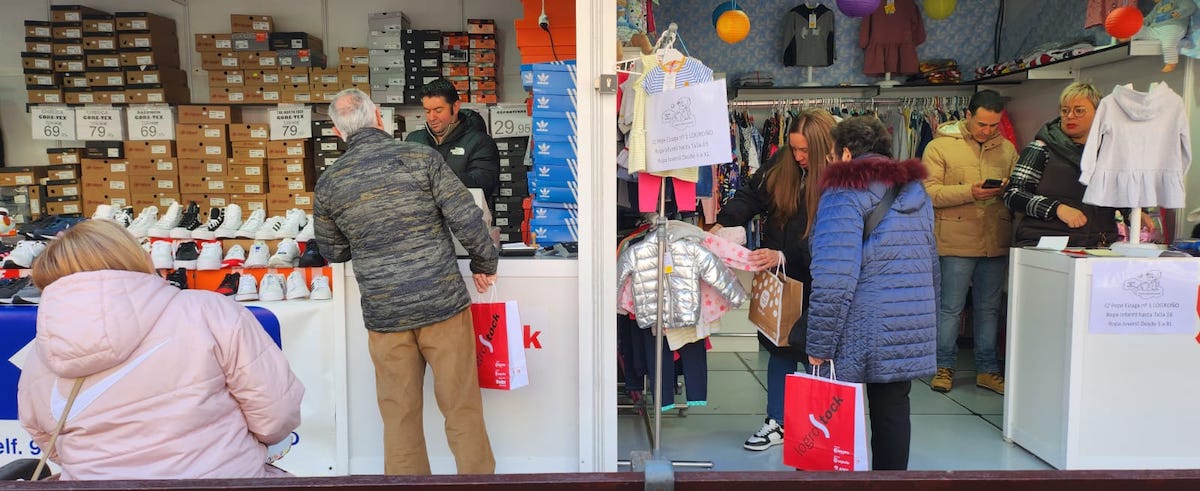
I want to click on blue shoe box, so click(x=544, y=77).